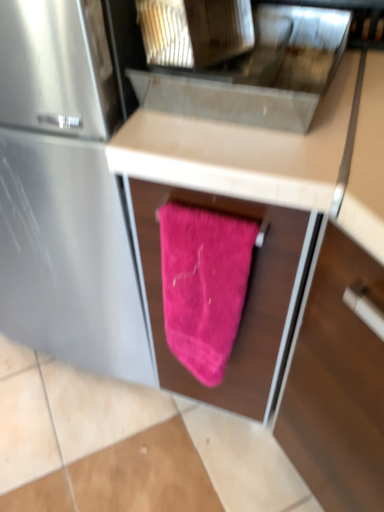
Question: From the image's perspective, is pink fabric at center located above or below metallic stainless steel sink at upper center?

Choices:
 (A) below
 (B) above

Answer: (A)

Question: From their relative heights in the image, would you say pink fabric at center is taller or shorter than metallic stainless steel sink at upper center?

Choices:
 (A) short
 (B) tall

Answer: (B)

Question: Which object is the farthest from the pink fuzzy towel at center?

Choices:
 (A) metallic stainless steel sink at upper center
 (B) pink fabric at center

Answer: (A)

Question: Based on their relative distances, which object is nearer to the pink fabric at center?

Choices:
 (A) pink fuzzy towel at center
 (B) metallic stainless steel sink at upper center

Answer: (B)